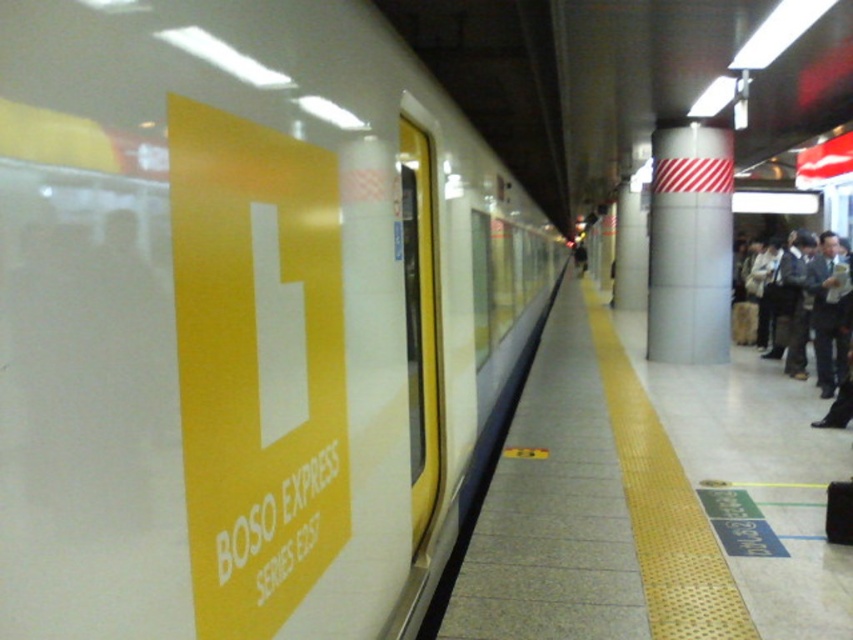
You are a passenger on the platform and want to board the train. You are currently at point [625,486] and need to reach point [840,257] to board the train. Which direction should you move to get closer to the boarding point?

To get closer to point [840,257], you should move towards it from point [625,486] since it is behind you relative to your current position.

From the picture: You are a maintenance worker assigned to inspect the yellow rubber platform at center and the white glossy pillar at center. Which object requires more time to inspect due to its size?

The yellow rubber platform at center is bigger than the white glossy pillar at center, so the yellow rubber platform at center will require more time to inspect.

You are a commuter waiting to board the BOSO EXPRESS SERIES E257 train. You are standing on the yellow rubber platform at center. Where should you position yourself relative to the dark gray suit at right to ensure you board the train safely?

You should position yourself to the left of the dark gray suit at right since the yellow rubber platform at center is already to the left of the dark gray suit at right, aligning you closer to the train entrance.